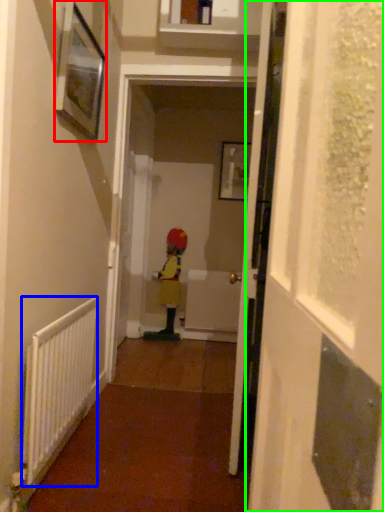
Question: Which is nearer to the picture frame (highlighted by a red box)? radiator (highlighted by a blue box) or screen door (highlighted by a green box).

Choices:
 (A) radiator
 (B) screen door

Answer: (A)